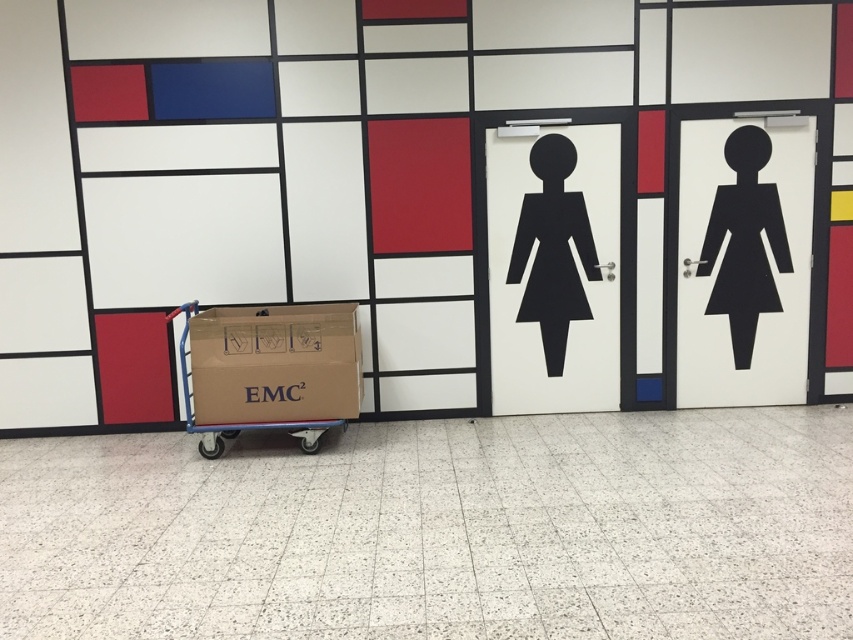
You are moving a brown cardboard trolley at center and need to place it next to the black matte sign at right. Given their sizes, will the trolley fit in the space where the sign is currently located?

The brown cardboard trolley at center is bigger than the black matte sign at right, so it may not fit in the space where the sign is located unless there is additional room available.

You are a delivery person with a trolley that is 1.5 meters long. You need to move the brown cardboard trolley at center closer to the black matte figure at center. Is there enough space between them to maneuver the trolley without hitting anything?

The distance between the brown cardboard trolley at center and the black matte figure at center is 1.69 meters. Since the trolley is 1.5 meters long, there is sufficient space to maneuver it without hitting anything as the distance is greater than the trolley length.

You are moving a brown cardboard trolley at center and need to place it near the wall. However, there is a black matte figure at center in the way. Based on their positions, can you move the trolley to the side without moving the figure?

The brown cardboard trolley at center is located below the black matte figure at center, so you can move the trolley sideways to either the left or right while keeping it below the figure to avoid obstruction.